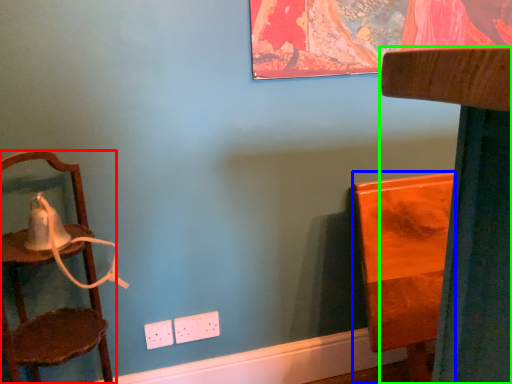
Question: Which object is positioned closest to chair (highlighted by a red box)? Select from furniture (highlighted by a blue box) and furniture (highlighted by a green box).

Choices:
 (A) furniture
 (B) furniture

Answer: (A)